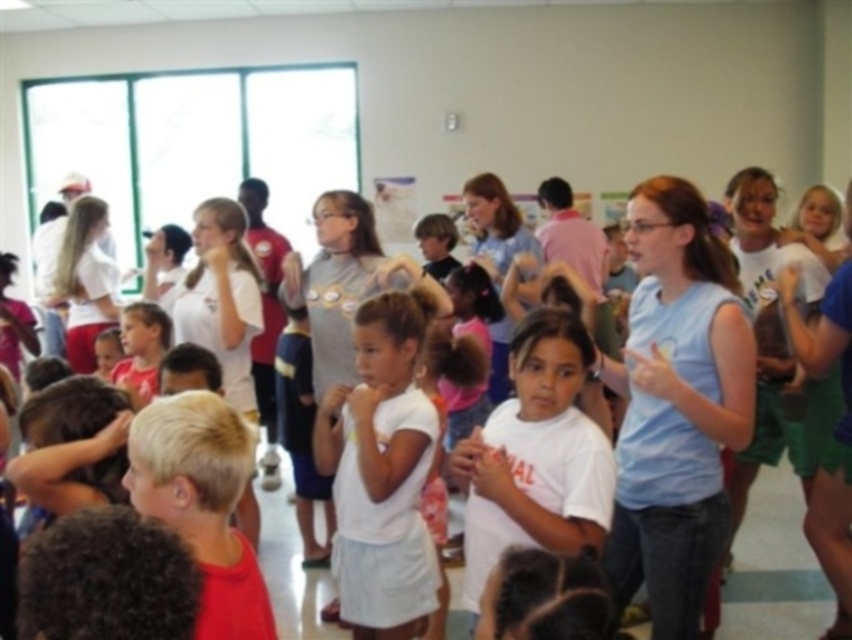
Consider the image. You are a photographer trying to capture a clear shot of both the light blue sleeveless shirt at center and the white cotton shirt at center. Since you want both shirts to be in focus, which one should you adjust your camera focus to prioritize?

You should prioritize focusing on the light blue sleeveless shirt at center because it is closer to the viewer, ensuring both shirts will be in focus when the camera adjusts for the closer object.

You are a photographer taking a picture of the group. You notice the light blue sleeveless shirt at center and the white matte shirt at center. Which shirt is covering part of the other?

The light blue sleeveless shirt at center is positioned over the white matte shirt at center, so it is covering part of the white matte shirt at center.